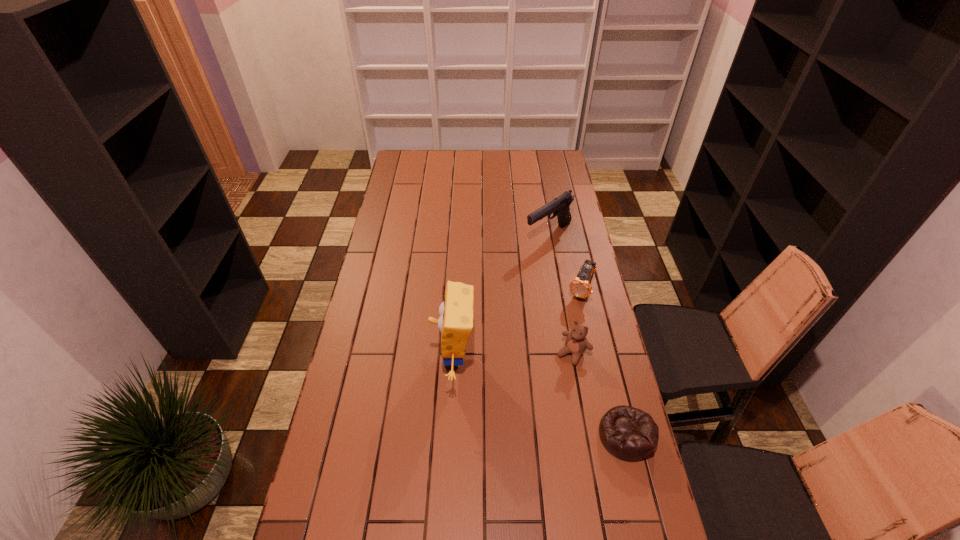
Choose which object is the nearest neighbor to the second farthest object. Please provide its 2D coordinates. Your answer should be formatted as a tuple, i.e. [(x, y)], where the tuple contains the x and y coordinates of a point satisfying the conditions above.

[(576, 343)]

Identify which object is located as the second nearest to the sponge. Please provide its 2D coordinates. Your answer should be formatted as a tuple, i.e. [(x, y)], where the tuple contains the x and y coordinates of a point satisfying the conditions above.

[(580, 286)]

Identify the location of free region that satisfies the following two spatial constraints: 1. on the front side of the fourth nearest object; 2. on the right side of the second tallest object. The height and width of the screenshot is (540, 960). (559, 292).

The height and width of the screenshot is (540, 960). Identify the location of free location that satisfies the following two spatial constraints: 1. on the front side of the shortest object; 2. on the right side of the teddy bear. (588, 435).